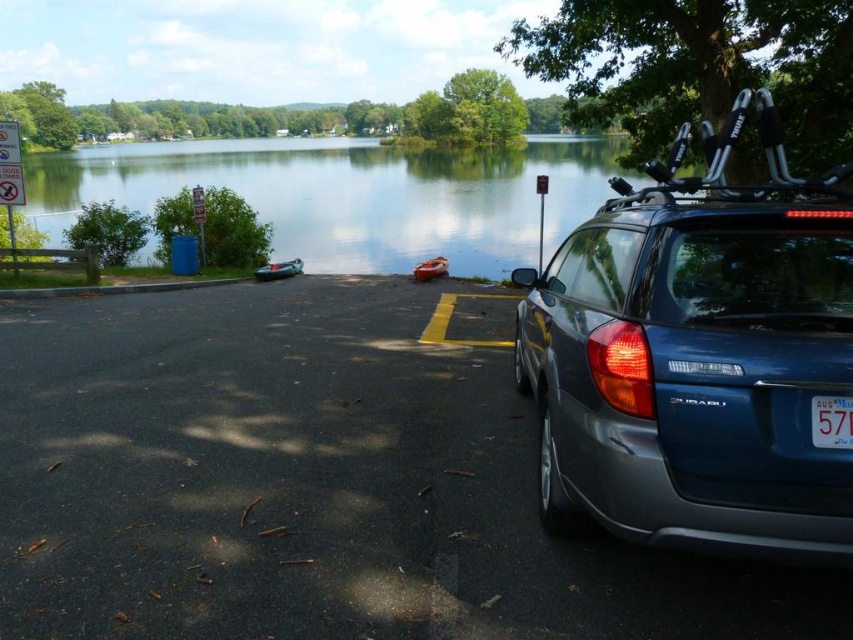
Based on the photo, you are a delivery person trying to park your van in the parking lot. You see the dark gray asphalt at lower right and the blue plastic license plate at lower right. Which one is closer to the ground?

The dark gray asphalt at lower right is positioned under the blue plastic license plate at lower right, so the asphalt is closer to the ground.

You are standing at the camera position and want to pick up an object located at point (x=131, y=561). Can you reach it without moving your feet?

The point (x=131, y=561) is 11.55 feet away from the camera, so you cannot reach it without moving your feet since it is too far.

You are standing at the point labeled point (53, 188) and want to walk to the point labeled point (654, 500). Which direction should you move in relation to the Subaru vehicle parked on the right side of the frame?

To reach point (654, 500) from point (53, 188), you should move towards the Subaru vehicle parked on the right side of the frame since point (654, 500) is in front of point (53, 188).